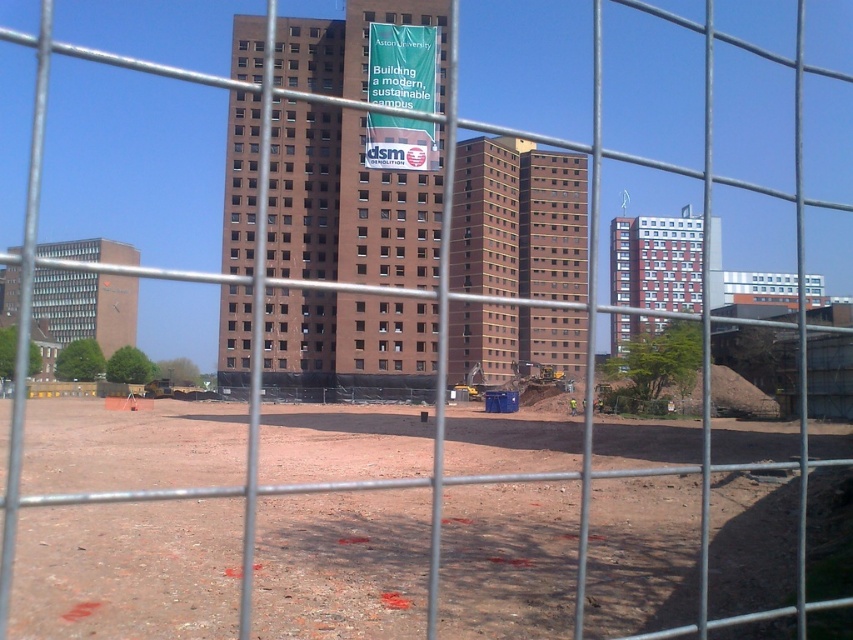
Does brown dirt field at center have a lesser height compared to green fabric banner at center?

Yes.

Is brown dirt field at center in front of green fabric banner at center?

No.

Where is `brown dirt field at center`? brown dirt field at center is located at coordinates (126, 570).